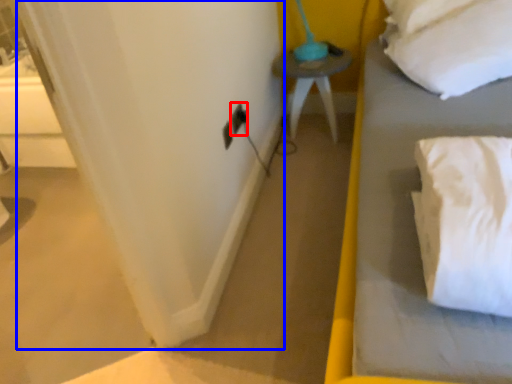
Question: Which of the following is the closest to the observer, electric outlet (highlighted by a red box) or curtain (highlighted by a blue box)?

Choices:
 (A) electric outlet
 (B) curtain

Answer: (B)